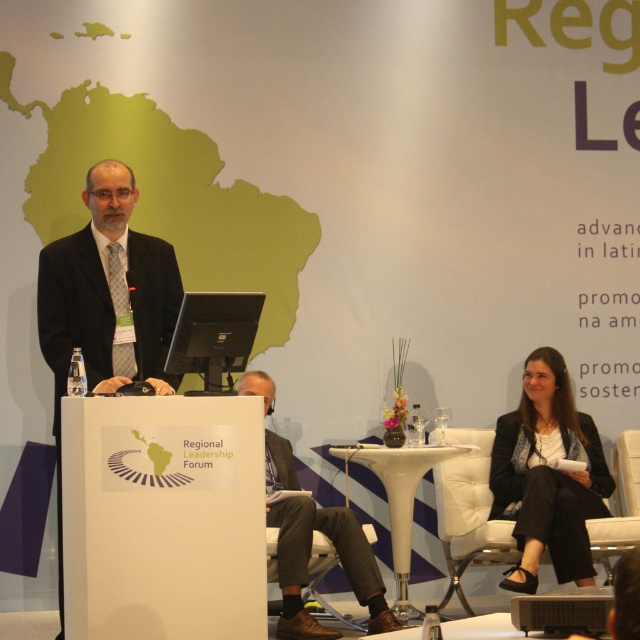
Question: Which of these objects is positioned farthest from the black fabric jacket at lower right?

Choices:
 (A) black suit at center
 (B) dark gray suit at center
 (C) white leather chair at lower right

Answer: (A)

Question: Considering the relative positions of black fabric jacket at lower right and white leather chair at lower right in the image provided, where is black fabric jacket at lower right located with respect to white leather chair at lower right?

Choices:
 (A) above
 (B) below

Answer: (A)

Question: Does black suit at center have a greater width compared to black fabric jacket at lower right?

Choices:
 (A) no
 (B) yes

Answer: (A)

Question: Which of these objects is positioned closest to the black fabric jacket at lower right?

Choices:
 (A) white leather chair at lower right
 (B) black suit at center
 (C) dark gray suit at center

Answer: (A)

Question: Among these points, which one is nearest to the camera?

Choices:
 (A) (500, 436)
 (B) (99, 172)
 (C) (484, 518)
 (D) (282, 596)

Answer: (B)

Question: Does black suit at center lie in front of white leather chair at lower right?

Choices:
 (A) yes
 (B) no

Answer: (A)